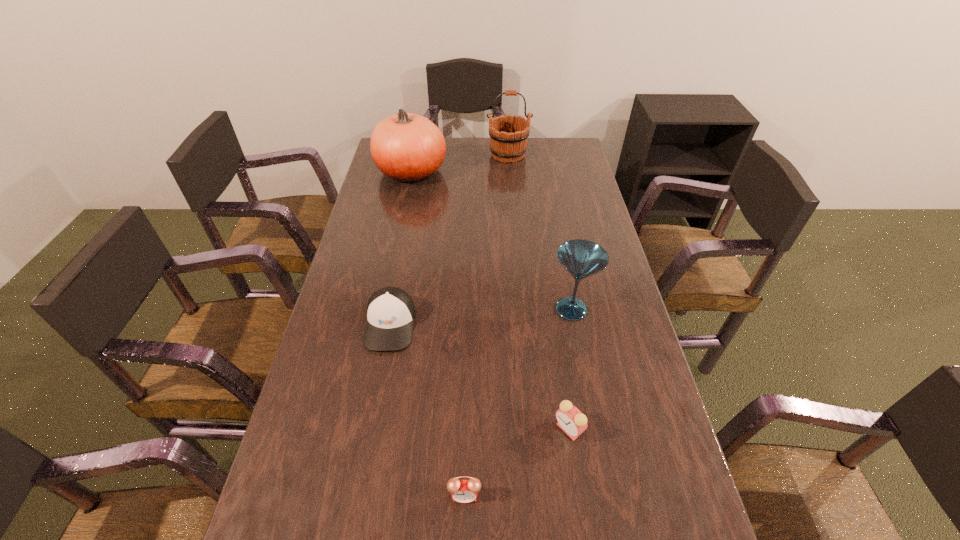
Locate an element on the screen. The height and width of the screenshot is (540, 960). wine bucket is located at coordinates (507, 144).

Find the location of `pumpkin`. pumpkin is located at coordinates (407, 147).

Image resolution: width=960 pixels, height=540 pixels. I want to click on martini, so click(581, 258).

Locate an element on the screen. Image resolution: width=960 pixels, height=540 pixels. cap is located at coordinates (391, 312).

This screenshot has width=960, height=540. I want to click on the farther alarm clock, so click(570, 419).

Locate an element on the screen. This screenshot has width=960, height=540. the right alarm clock is located at coordinates (570, 419).

Where is `the left alarm clock`? the left alarm clock is located at coordinates (462, 491).

What are the coordinates of `the nearer alarm clock` in the screenshot? It's located at (462, 491).

Locate an element on the screen. The width and height of the screenshot is (960, 540). free location located 0.330m on the left of the wine bucket is located at coordinates (407, 155).

Find the location of a particular element. vacant area situated 0.070m on the front of the pumpkin is located at coordinates (405, 203).